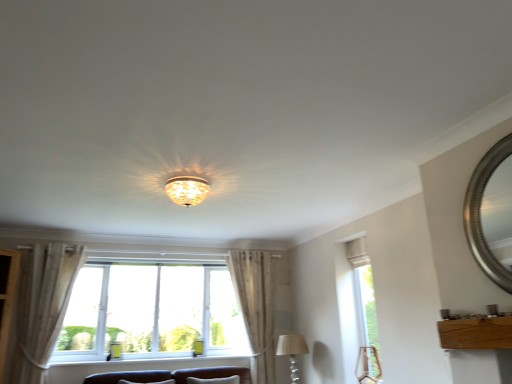
What is the approximate width of white plastic window at center, which is the second window from right to left?

It is 10.78 inches.

Where is `beige fabric lampshade at lower center, the first lamp positioned from the bottom`? The width and height of the screenshot is (512, 384). beige fabric lampshade at lower center, the first lamp positioned from the bottom is located at coordinates (292, 351).

How much space does translucent glass chandelier at center, the first lamp positioned from the top, occupy horizontally?

translucent glass chandelier at center, the first lamp positioned from the top, is 14.25 inches wide.

The image size is (512, 384). In order to click on translucent glass chandelier at center, the first lamp positioned from the top in this screenshot , I will do `click(187, 190)`.

Image resolution: width=512 pixels, height=384 pixels. What do you see at coordinates (364, 312) in the screenshot?
I see `clear glass window at right, which ranks as the 1th window in right-to-left order` at bounding box center [364, 312].

The height and width of the screenshot is (384, 512). Describe the element at coordinates (256, 307) in the screenshot. I see `white sheer curtain at center, the 2th curtain when ordered from front to back` at that location.

The image size is (512, 384). I want to click on silver metallic mirror at upper right, so click(x=480, y=212).

Is point (472, 234) behind point (212, 359)?

No, it is in front of (212, 359).

How far apart are silver metallic mirror at upper right and white painted wood at lower center?

silver metallic mirror at upper right is 3.70 meters from white painted wood at lower center.

From the picture: Is silver metallic mirror at upper right taller or shorter than white painted wood at lower center?

silver metallic mirror at upper right is taller than white painted wood at lower center.

In the image, is silver metallic mirror at upper right on the left side or the right side of white painted wood at lower center?

silver metallic mirror at upper right is positioned on white painted wood at lower center's right side.

Is white sheer curtain at center, the 2th curtain when ordered from front to back, smaller than white painted wood at lower center?

Incorrect, white sheer curtain at center, the 2th curtain when ordered from front to back, is not smaller in size than white painted wood at lower center.

Is white sheer curtain at center, the first curtain in the back-to-front sequence, positioned beyond the bounds of white painted wood at lower center?

white sheer curtain at center, the first curtain in the back-to-front sequence, lies outside white painted wood at lower center's area.

Is white sheer curtain at center, the 2th curtain when ordered from front to back, positioned behind white painted wood at lower center?

Yes.

Would you consider white sheer curtain at center, the 1th curtain from the right, to be distant from white painted wood at lower center?

No, white sheer curtain at center, the 1th curtain from the right, is not far away from white painted wood at lower center.

Which of these two, translucent glass chandelier at center, which is counted as the second lamp, starting from the back, or light beige fabric curtain at left, which is counted as the second curtain, starting from the right, stands shorter?

translucent glass chandelier at center, which is counted as the second lamp, starting from the back.

How different are the orientations of translucent glass chandelier at center, which appears as the 1th lamp when viewed from the front, and light beige fabric curtain at left, the 1th curtain viewed from the left, in degrees?

0.00026 degrees.

Is translucent glass chandelier at center, arranged as the 2th lamp when ordered from the bottom, facing towards light beige fabric curtain at left, which is counted as the second curtain, starting from the right?

No, translucent glass chandelier at center, arranged as the 2th lamp when ordered from the bottom, is not facing towards light beige fabric curtain at left, which is counted as the second curtain, starting from the right.

From the image's perspective, which is below, translucent glass chandelier at center, the first lamp positioned from the top, or light beige fabric curtain at left, marked as the first curtain in a front-to-back arrangement?

light beige fabric curtain at left, marked as the first curtain in a front-to-back arrangement, appears lower in the image.

What's the angular difference between white plastic window at center, arranged as the first window when viewed from the left, and white painted wood at lower center's facing directions?

They differ by 0.515 degrees in their facing directions.

Looking at this image, could you measure the distance between white plastic window at center, arranged as the first window when viewed from the left, and white painted wood at lower center?

The distance of white plastic window at center, arranged as the first window when viewed from the left, from white painted wood at lower center is 47.38 centimeters.

Is white plastic window at center, which is the second window from right to left, facing towards white painted wood at lower center?

No, white plastic window at center, which is the second window from right to left, is not aimed at white painted wood at lower center.

In terms of height, does white plastic window at center, which is the second window from right to left, look taller or shorter compared to white painted wood at lower center?

Considering their sizes, white plastic window at center, which is the second window from right to left, has more height than white painted wood at lower center.

Is light beige fabric curtain at left, which is counted as the second curtain, starting from the right, facing towards translucent glass chandelier at center, which is counted as the second lamp, starting from the back?

No, light beige fabric curtain at left, which is counted as the second curtain, starting from the right, does not turn towards translucent glass chandelier at center, which is counted as the second lamp, starting from the back.

Between light beige fabric curtain at left, which is counted as the second curtain, starting from the right, and translucent glass chandelier at center, which is counted as the second lamp, starting from the back, which one has less height?

Standing shorter between the two is translucent glass chandelier at center, which is counted as the second lamp, starting from the back.

Considering the sizes of light beige fabric curtain at left, which ranks as the second curtain in back-to-front order, and translucent glass chandelier at center, arranged as the 2th lamp when ordered from the bottom, in the image, is light beige fabric curtain at left, which ranks as the second curtain in back-to-front order, bigger or smaller than translucent glass chandelier at center, arranged as the 2th lamp when ordered from the bottom,?

In the image, light beige fabric curtain at left, which ranks as the second curtain in back-to-front order, appears to be larger than translucent glass chandelier at center, arranged as the 2th lamp when ordered from the bottom.

Which is in front, light beige fabric curtain at left, which ranks as the second curtain in back-to-front order, or translucent glass chandelier at center, which is counted as the second lamp, starting from the back?

translucent glass chandelier at center, which is counted as the second lamp, starting from the back, is in front.

Can you confirm if white painted wood at lower center is shorter than wooden board at lower right?

Yes, white painted wood at lower center is shorter than wooden board at lower right.

Which of these two, white painted wood at lower center or wooden board at lower right, is wider?

white painted wood at lower center.

Find the location of a particular element. This screenshot has height=384, width=512. furniture above the white painted wood at lower center (from the image's perspective) is located at coordinates (476, 333).

Is white painted wood at lower center directly adjacent to wooden board at lower right?

white painted wood at lower center and wooden board at lower right are not in contact.

From the image's perspective, is white painted wood at lower center positioned above or below clear glass window at right, which ranks as the 1th window in right-to-left order?

Based on their image positions, white painted wood at lower center is located beneath clear glass window at right, which ranks as the 1th window in right-to-left order.

From a real-world perspective, is white painted wood at lower center physically located above or below clear glass window at right, which is the 2th window in left-to-right order?

white painted wood at lower center is situated lower than clear glass window at right, which is the 2th window in left-to-right order, in the real world.

Is white painted wood at lower center positioned in front of clear glass window at right, which ranks as the 1th window in right-to-left order?

No.

Identify the location of window sill below the silver metallic mirror at upper right (from the image's perspective). This screenshot has height=384, width=512. (158, 363).

Image resolution: width=512 pixels, height=384 pixels. What are the coordinates of `curtain that appears on the right of white painted wood at lower center` in the screenshot? It's located at click(x=256, y=307).

Looking at the image, which one is located closer to white painted wood at lower center, white plastic window at center, arranged as the first window when viewed from the left, or white sheer curtain at center, the 1th curtain from the right?

white plastic window at center, arranged as the first window when viewed from the left.

When comparing their distances from silver metallic mirror at upper right, does translucent glass chandelier at center, the 1th lamp from the left, or clear glass window at right, which is the 2th window in left-to-right order, seem further?

translucent glass chandelier at center, the 1th lamp from the left, is further to silver metallic mirror at upper right.

From the image, which object appears to be nearer to white plastic window at center, which is the second window from right to left, silver metallic mirror at upper right or wooden board at lower right?

wooden board at lower right lies closer to white plastic window at center, which is the second window from right to left, than the other object.

Based on their spatial positions, is wooden board at lower right or white sheer curtain at center, which is counted as the second curtain, starting from the left, closer to silver metallic mirror at upper right?

wooden board at lower right lies closer to silver metallic mirror at upper right than the other object.

From the image, which object appears to be nearer to translucent glass chandelier at center, the first lamp positioned from the top, clear glass window at right, which ranks as the 1th window in right-to-left order, or white plastic window at center, arranged as the first window when viewed from the left?

white plastic window at center, arranged as the first window when viewed from the left, is positioned closer to the anchor translucent glass chandelier at center, the first lamp positioned from the top.

Considering their positions, is white plastic window at center, arranged as the first window when viewed from the left, positioned closer to wooden board at lower right than white sheer curtain at center, the 2th curtain when ordered from front to back?

white sheer curtain at center, the 2th curtain when ordered from front to back, is positioned closer to the anchor wooden board at lower right.

Consider the image. From the image, which object appears to be farther from beige fabric lampshade at lower center, marked as the 2th lamp in a left-to-right arrangement, silver metallic mirror at upper right or white painted wood at lower center?

silver metallic mirror at upper right is further to beige fabric lampshade at lower center, marked as the 2th lamp in a left-to-right arrangement.

From the image, which object appears to be nearer to translucent glass chandelier at center, arranged as the 2th lamp when ordered from the bottom, white sheer curtain at center, the 1th curtain from the right, or clear glass window at right, which ranks as the 1th window in right-to-left order?

white sheer curtain at center, the 1th curtain from the right, is positioned closer to the anchor translucent glass chandelier at center, arranged as the 2th lamp when ordered from the bottom.

The image size is (512, 384). I want to click on window between translucent glass chandelier at center, the 1th lamp from the left, and silver metallic mirror at upper right, so click(364, 312).

Where is `furniture between silver metallic mirror at upper right and beige fabric lampshade at lower center, the 2th lamp viewed from the front, in the front-back direction`? Image resolution: width=512 pixels, height=384 pixels. furniture between silver metallic mirror at upper right and beige fabric lampshade at lower center, the 2th lamp viewed from the front, in the front-back direction is located at coordinates (476, 333).

This screenshot has width=512, height=384. In order to click on curtain between white painted wood at lower center and clear glass window at right, which is the 2th window in left-to-right order, in the horizontal direction in this screenshot , I will do `click(256, 307)`.

Identify the location of window sill located between light beige fabric curtain at left, which is counted as the second curtain, starting from the right, and white sheer curtain at center, the first curtain in the back-to-front sequence, in the left-right direction. The width and height of the screenshot is (512, 384). [158, 363].